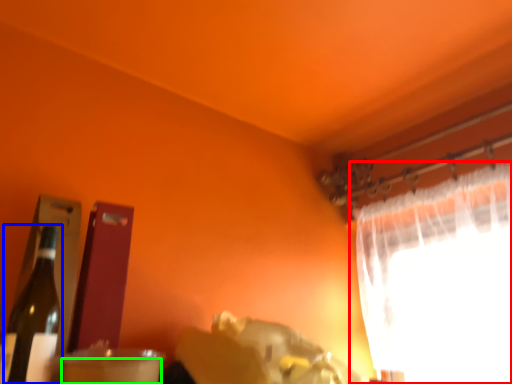
Question: Which object is the farthest from curtain (highlighted by a red box)? Choose among these: bottle (highlighted by a blue box) or drinking straw (highlighted by a green box).

Choices:
 (A) bottle
 (B) drinking straw

Answer: (A)